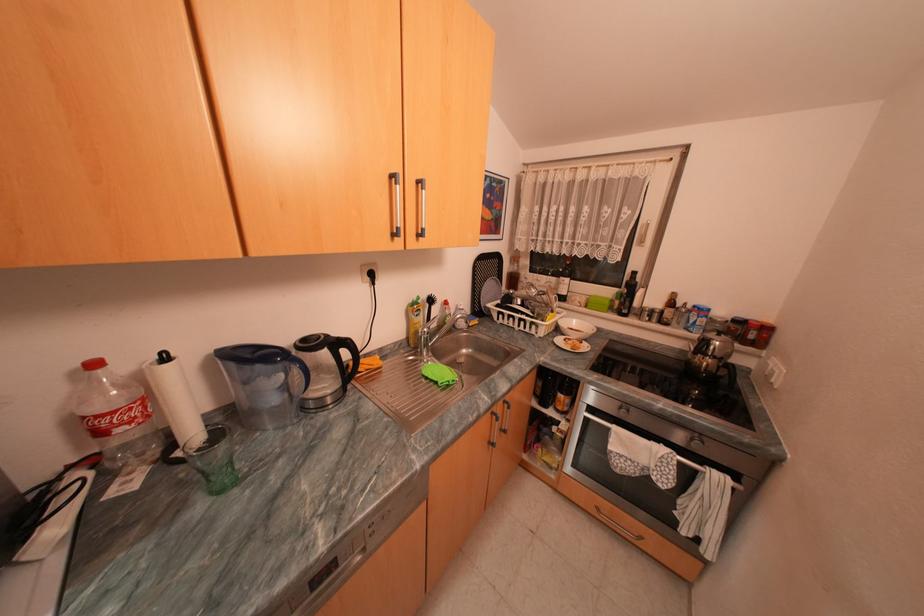
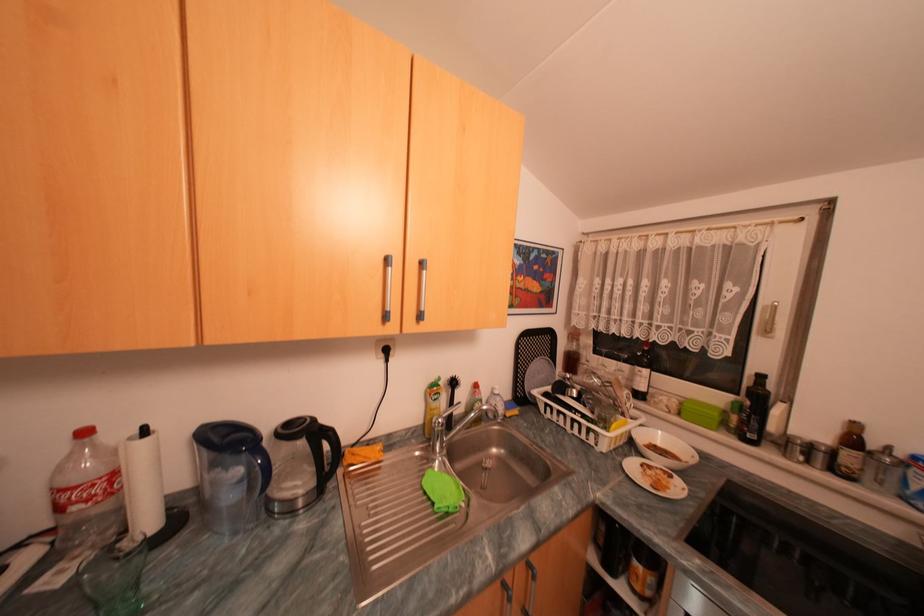
Find the pixel in the second image that matches the point at 175,358 in the first image.

(155, 432)